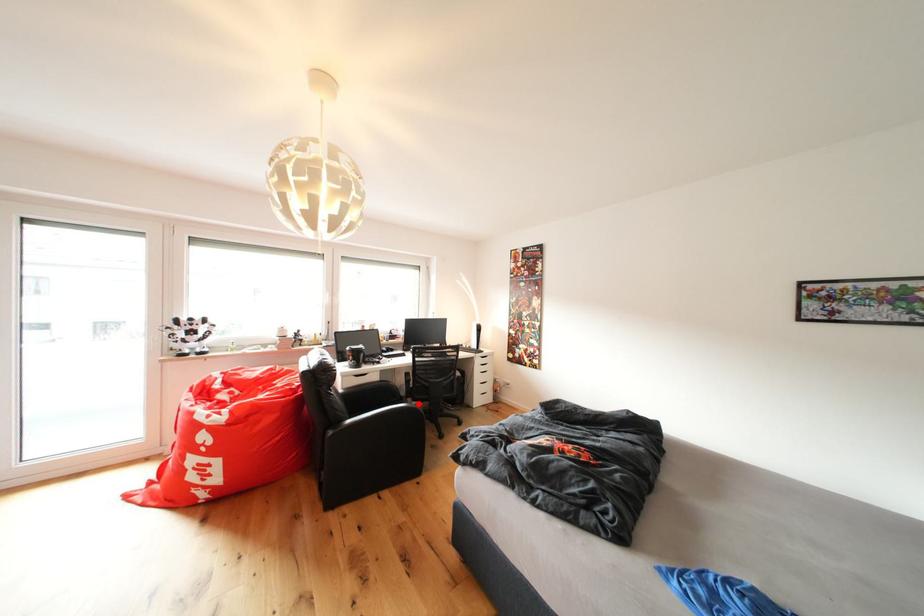
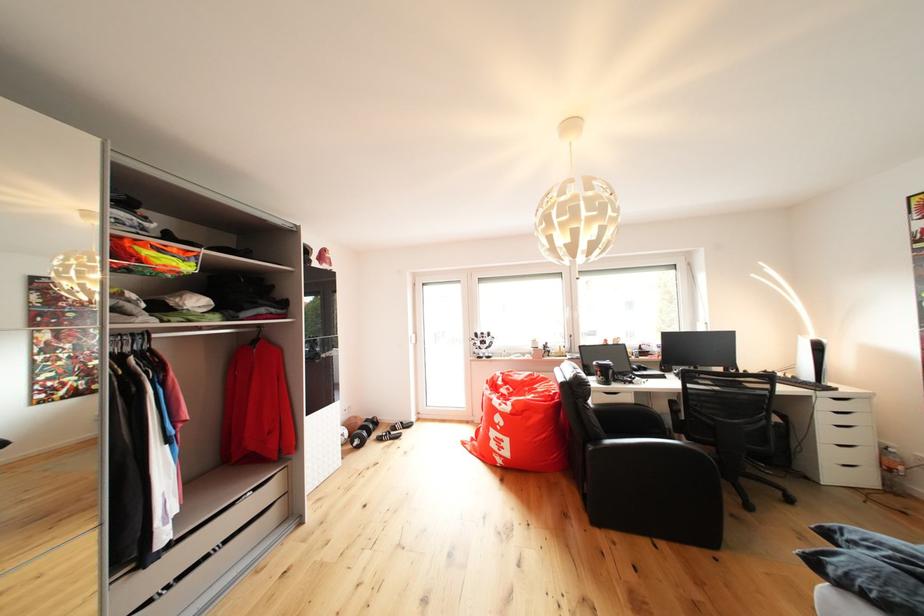
Question: I am providing you with two images of the same scene from different viewpoints. Given a red point in image1, look at the same physical point in image2. Is it:

Choices:
 (A) Closer to the viewpoint
 (B) Farther from the viewpoint

Answer: (A)